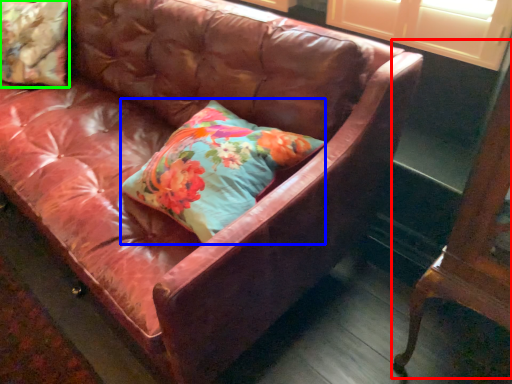
Question: Considering the real-world distances, which object is farthest from furniture (highlighted by a red box)? pillow (highlighted by a blue box) or pillow (highlighted by a green box)?

Choices:
 (A) pillow
 (B) pillow

Answer: (B)